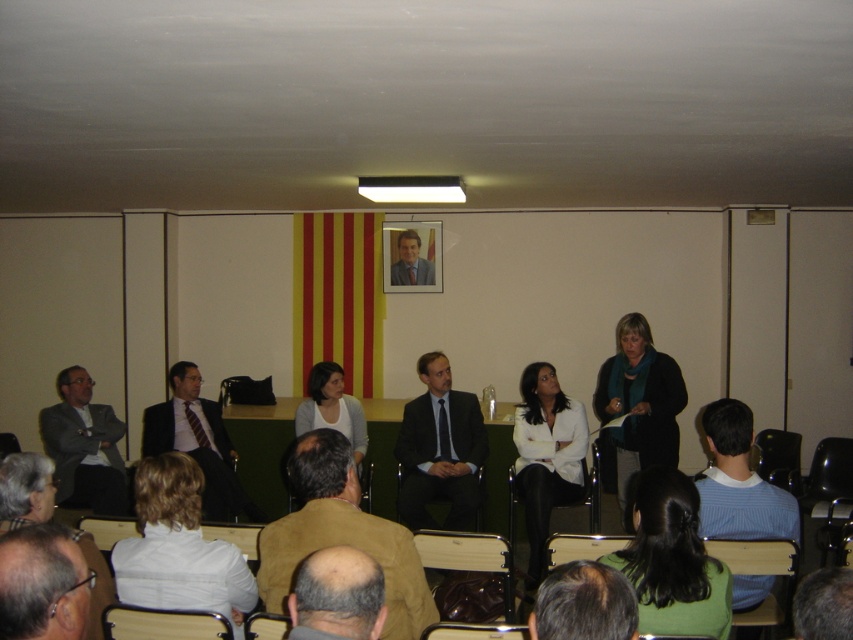
Between point (225, 556) and point (399, 244), which one is positioned behind?

The point (399, 244) is behind.

Identify the location of white shirt at lower left. The width and height of the screenshot is (853, 640). (178, 547).

Is point (158, 458) less distant than point (399, 252)?

Yes, it is.

Locate an element on the screen. This screenshot has width=853, height=640. white shirt at lower left is located at coordinates (178, 547).

Between matte gray suit at left and smooth black suit at center, which one is positioned higher?

Positioned higher is smooth black suit at center.

Is matte gray suit at left below smooth black suit at center?

Yes, matte gray suit at left is below smooth black suit at center.

Does point (84, 464) come in front of point (430, 273)?

That is True.

Where is `matte gray suit at left`? matte gray suit at left is located at coordinates (84, 445).

Is point (412, 454) farther from viewer compared to point (425, 282)?

No, (412, 454) is closer to viewer.

Can you confirm if dark suit at center is positioned to the right of smooth black suit at center?

Indeed, dark suit at center is positioned on the right side of smooth black suit at center.

What do you see at coordinates (439, 449) in the screenshot? The height and width of the screenshot is (640, 853). I see `dark suit at center` at bounding box center [439, 449].

The width and height of the screenshot is (853, 640). Find the location of `dark suit at center`. dark suit at center is located at coordinates (439, 449).